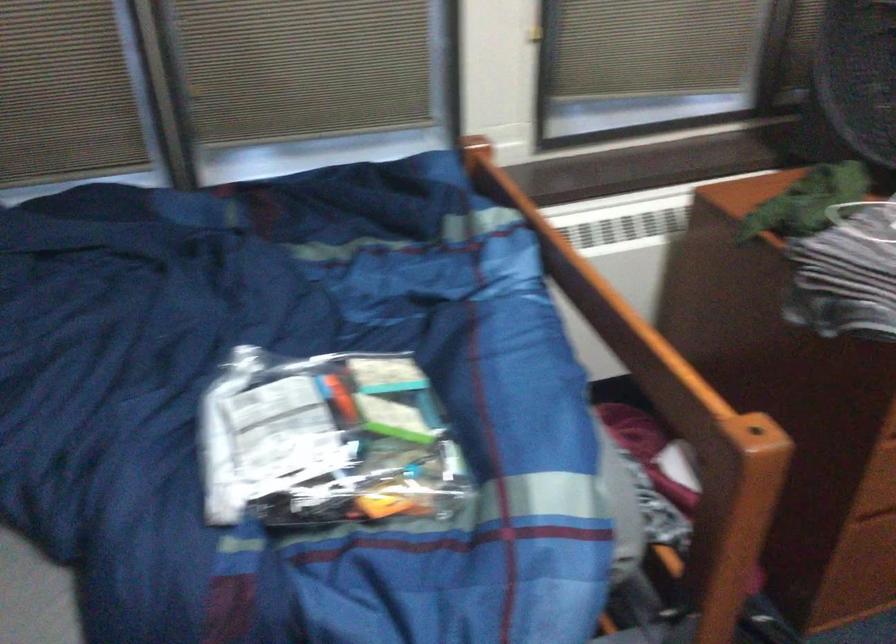
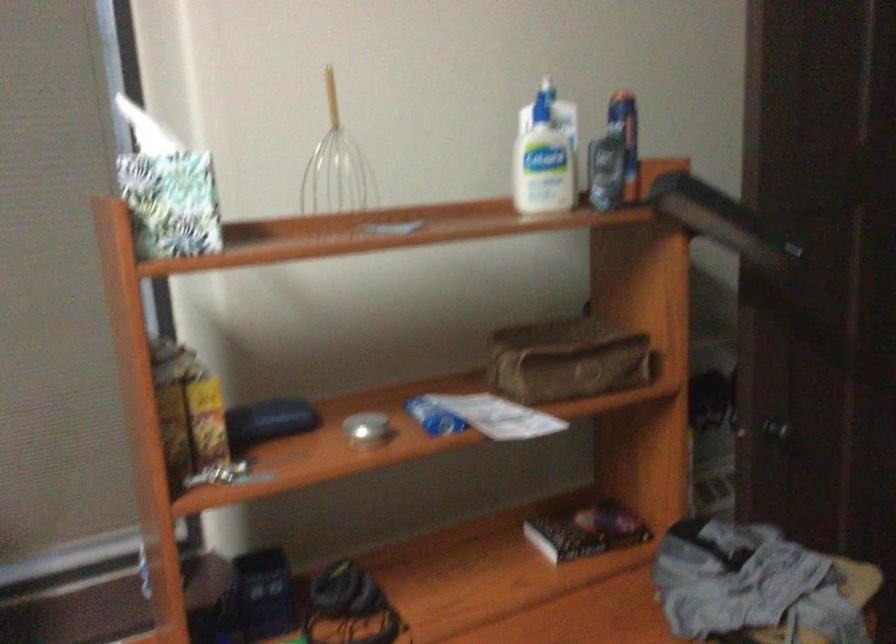
Question: The images are taken continuously from a first-person perspective. In which direction are you moving?

Choices:
 (A) Left
 (B) Right
 (C) Forward
 (D) Backward

Answer: (B)